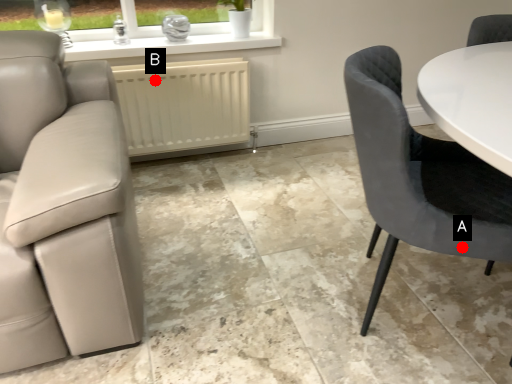
Question: Two points are circled on the image, labeled by A and B beside each circle. Among these points, which one is nearest to the camera?

Choices:
 (A) A is closer
 (B) B is closer

Answer: (A)